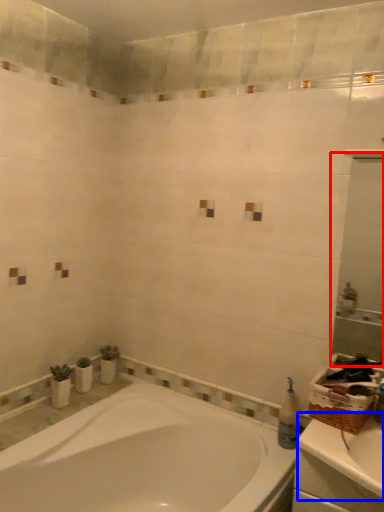
Question: Which object is closer to the camera taking this photo, mirror (highlighted by a red box) or counter top (highlighted by a blue box)?

Choices:
 (A) mirror
 (B) counter top

Answer: (B)